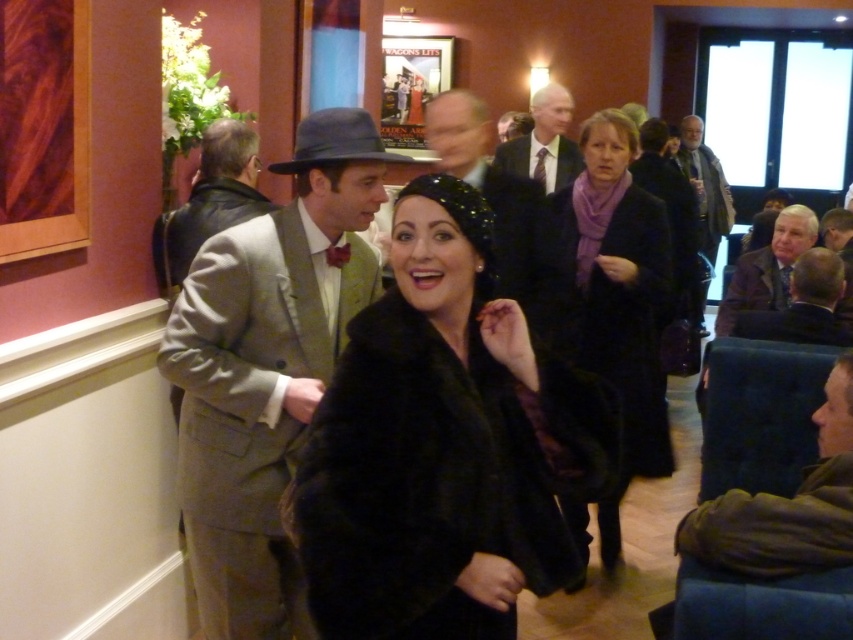
Can you confirm if matte black coat at center is positioned above matte black suit at center?

No.

Is matte black coat at center to the left of matte black suit at center from the viewer's perspective?

Incorrect, matte black coat at center is not on the left side of matte black suit at center.

This screenshot has height=640, width=853. What are the coordinates of `matte black coat at center` in the screenshot? It's located at (619, 282).

Does smooth black suit at center have a larger size compared to dark brown leather jacket at right?

No.

Between point (486, 196) and point (693, 115), which one is positioned in front?

Point (486, 196)

Does point (442, 99) come farther from viewer compared to point (705, 148)?

No, (442, 99) is in front of (705, 148).

The height and width of the screenshot is (640, 853). Find the location of `smooth black suit at center`. smooth black suit at center is located at coordinates (495, 196).

Looking at this image, is smooth black suit at center shorter than matte black suit at center?

No, smooth black suit at center is not shorter than matte black suit at center.

Does point (532, 248) come farther from viewer compared to point (534, 109)?

No, it is in front of (534, 109).

Locate an element on the screen. smooth black suit at center is located at coordinates (495, 196).